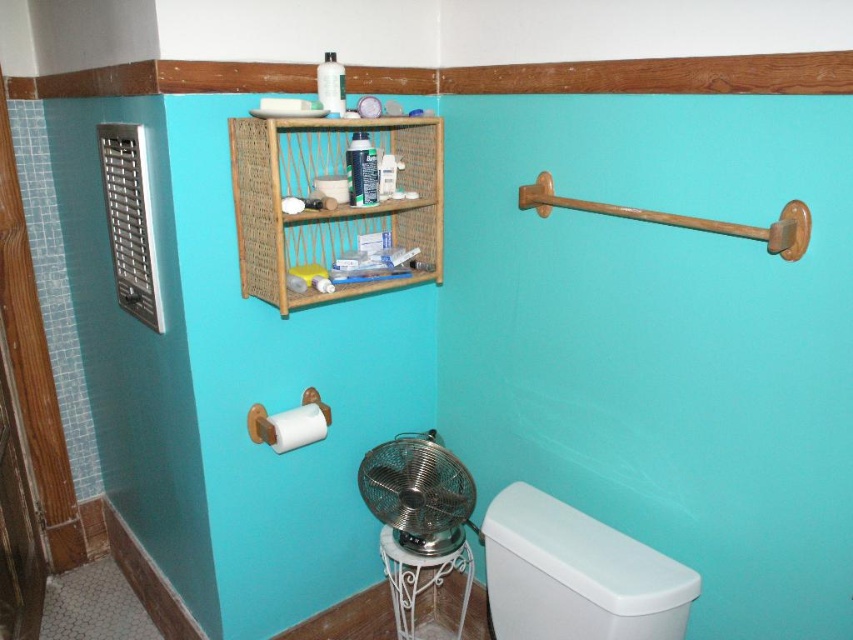
You are a bathroom designer planning to install a new 24 inch wide decorative shelf between the white plastic toilet at lower right and the white matte toilet paper at lower left. Based on the current spacing, will there be enough space for the shelf?

The distance between the white plastic toilet at lower right and the white matte toilet paper at lower left is 23.23 inches. Since the shelf is 24 inches wide, it will not fit in the available space.

You are standing in the bathroom and want to hang a small towel. The wooden towel bar at right is located at point (x=682, y=218). Is this point on the wooden towel bar at right?

Yes, the point (x=682, y=218) is on the wooden towel bar at right according to the description.